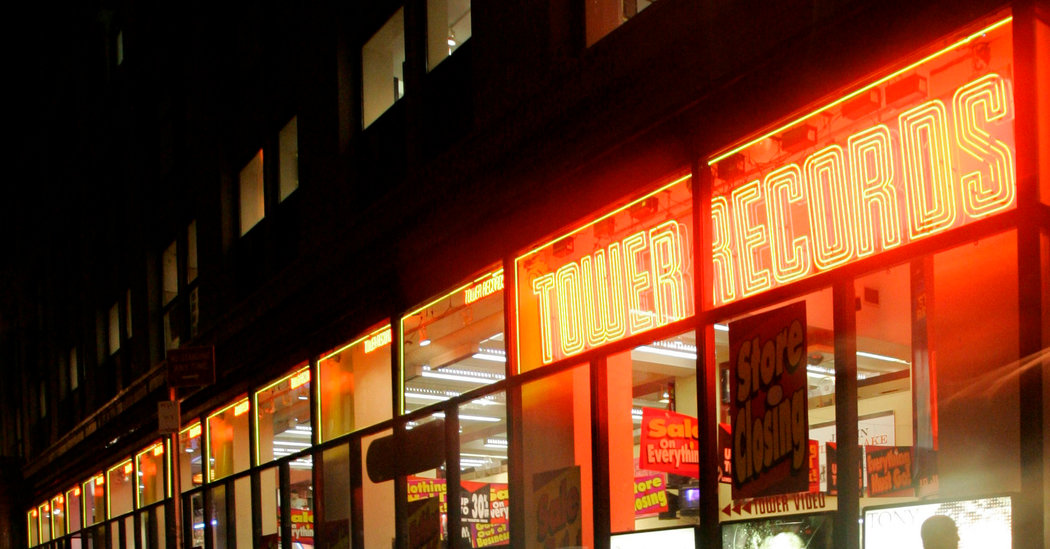
The height and width of the screenshot is (549, 1050). I want to click on the second floor windows, so click(x=254, y=203), click(x=284, y=170), click(x=395, y=87), click(x=441, y=38), click(x=602, y=31), click(x=176, y=280), click(x=108, y=324), click(x=72, y=385).